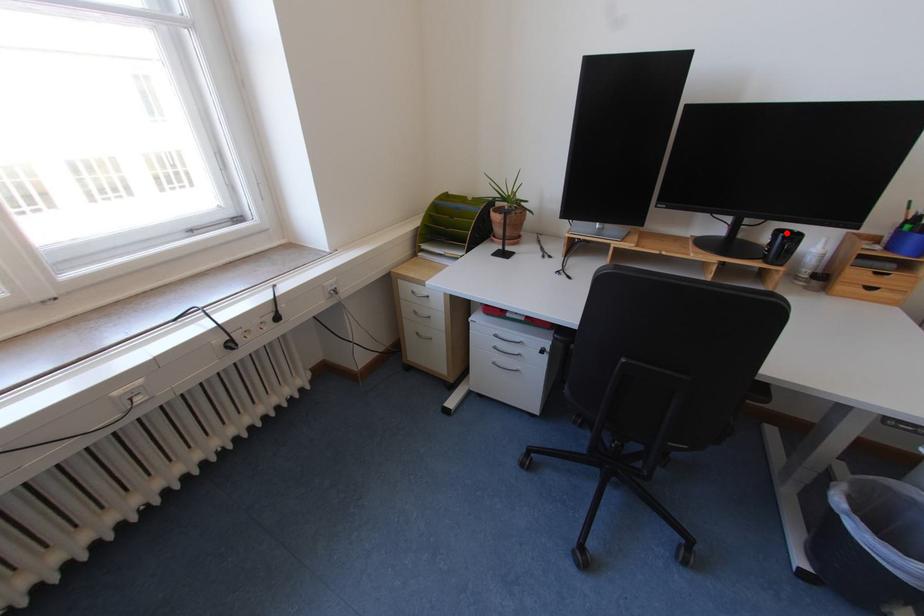
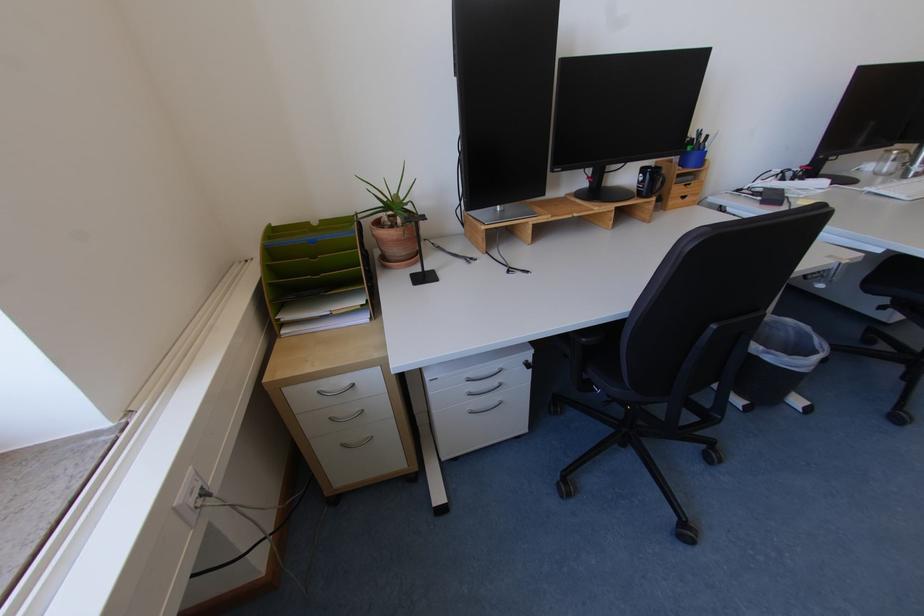
Where in the second image is the point corresponding to the highlighted location from the first image?

(650, 171)